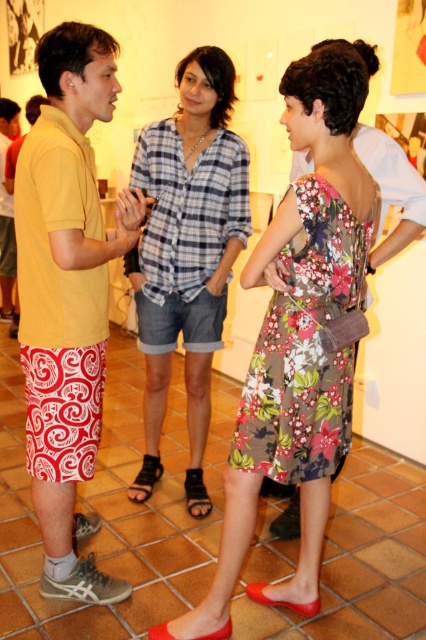
Does floral fabric dress at center appear on the right side of plaid cotton shirt at center?

Correct, you'll find floral fabric dress at center to the right of plaid cotton shirt at center.

Which of these two, floral fabric dress at center or plaid cotton shirt at center, stands taller?

plaid cotton shirt at center

Identify the location of floral fabric dress at center. (298, 340).

This screenshot has height=640, width=426. In order to click on floral fabric dress at center in this screenshot , I will do `click(298, 340)`.

Can you confirm if yellow cotton shirt at left is wider than floral-patterned fabric dress at center?

No, yellow cotton shirt at left is not wider than floral-patterned fabric dress at center.

Is yellow cotton shirt at left closer to camera compared to floral-patterned fabric dress at center?

No, yellow cotton shirt at left is further to the viewer.

Is point (74, 465) farther from camera compared to point (354, 230)?

Yes, point (74, 465) is farther from viewer.

Find the location of `yellow cotton shirt at left`. yellow cotton shirt at left is located at coordinates (68, 296).

Who is shorter, plaid cotton shirt at center or floral-patterned fabric dress at center?

floral-patterned fabric dress at center

Does plaid cotton shirt at center lie in front of floral-patterned fabric dress at center?

That is False.

Is point (192, 376) farther from viewer compared to point (276, 410)?

Yes, point (192, 376) is farther from viewer.

Where is `plaid cotton shirt at center`? Image resolution: width=426 pixels, height=640 pixels. plaid cotton shirt at center is located at coordinates (187, 252).